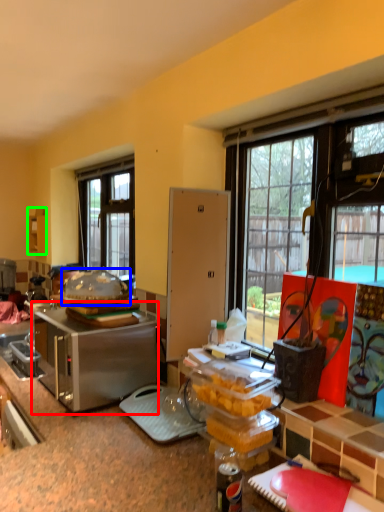
Question: Estimate the real-world distances between objects in this image. Which object is farther from appliance (highlighted by a red box), food (highlighted by a blue box) or cabinetry (highlighted by a green box)?

Choices:
 (A) food
 (B) cabinetry

Answer: (B)